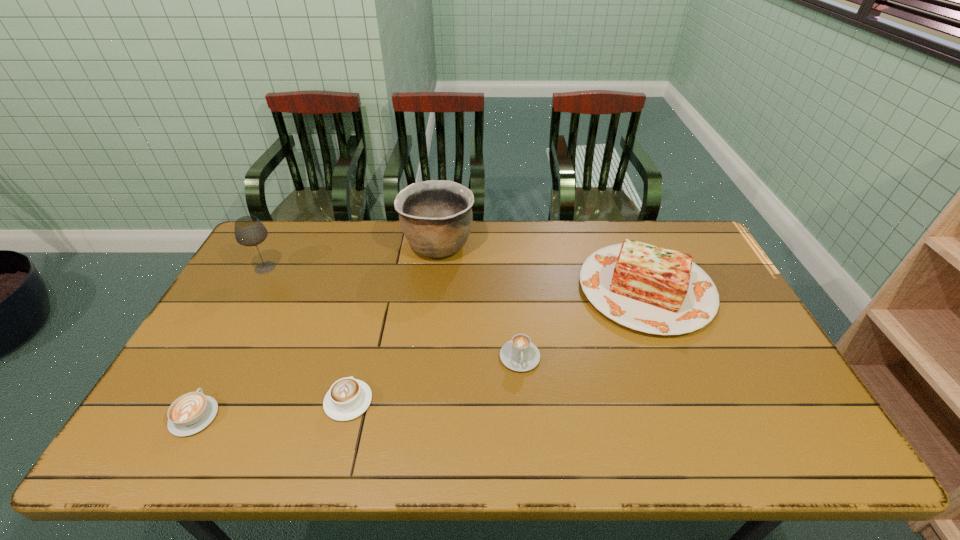
This screenshot has width=960, height=540. In order to click on vacant space situated 0.280m on the right of the pottery in this screenshot , I will do `click(554, 245)`.

Image resolution: width=960 pixels, height=540 pixels. Identify the location of free location located on the right of the wineglass. (321, 268).

At what (x,y) coordinates should I click in order to perform the action: click on vacant region located on the right of the rightmost object. Please return your answer as a coordinate pair (x, y). Looking at the image, I should click on click(728, 289).

You are a GUI agent. You are given a task and a screenshot of the screen. Output one action in this format:
    pyautogui.click(x=<x>, y=<y>)
    Task: Click on the vacant space located to the right of the farthest cappuccino
    The height and width of the screenshot is (540, 960).
    Given the screenshot: What is the action you would take?
    [526, 434]

Where is `free space located 0.140m with the handle on the right side of the second shortest object`? free space located 0.140m with the handle on the right side of the second shortest object is located at coordinates (364, 339).

This screenshot has width=960, height=540. Identify the location of vacant position located 0.220m with the handle on the right side of the second shortest object. (370, 319).

This screenshot has width=960, height=540. Find the location of `blank space located 0.280m with the handle on the right side of the second shortest object`. blank space located 0.280m with the handle on the right side of the second shortest object is located at coordinates (372, 304).

Identify the location of free space located on the side of the leftmost cappuccino with the handle. The width and height of the screenshot is (960, 540). (241, 329).

This screenshot has height=540, width=960. In order to click on free space located 0.190m on the side of the leftmost cappuccino with the handle in this screenshot , I will do `click(236, 337)`.

You are a GUI agent. You are given a task and a screenshot of the screen. Output one action in this format:
    pyautogui.click(x=<x>, y=<y>)
    Task: Click on the blank space located on the side of the leftmost cappuccino with the handle
    The height and width of the screenshot is (540, 960).
    Given the screenshot: What is the action you would take?
    pyautogui.click(x=248, y=316)